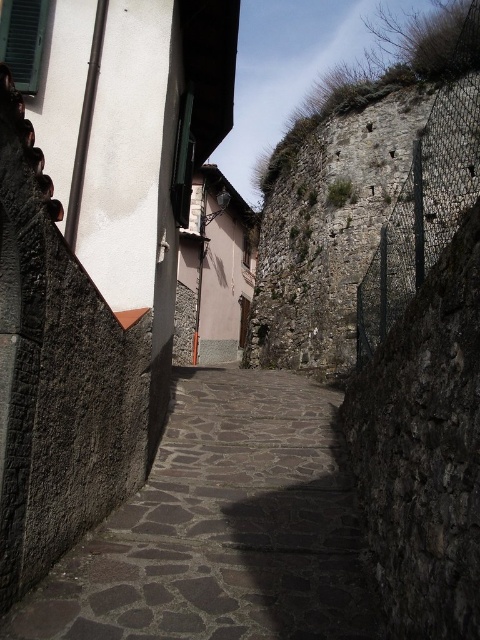
Is stone paved path at center positioned before rough stone wall at upper right?

Yes, stone paved path at center is closer to the viewer.

Find the location of a particular element. stone paved path at center is located at coordinates (222, 529).

Does point (359, 540) come farther from viewer compared to point (467, 208)?

No.

In order to click on stone paved path at center in this screenshot , I will do `click(222, 529)`.